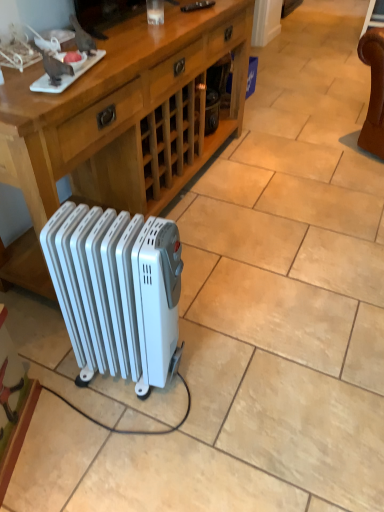
This screenshot has height=512, width=384. In order to click on vacant space in between white plastic radiator at lower center and wooden desk at center in this screenshot , I will do `click(190, 243)`.